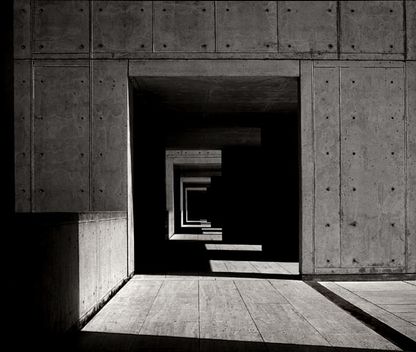
Locate an element on the screen. Image resolution: width=416 pixels, height=352 pixels. hallway corner is located at coordinates (174, 165), (182, 179), (187, 189), (128, 77), (297, 76), (220, 151), (206, 190), (211, 179).